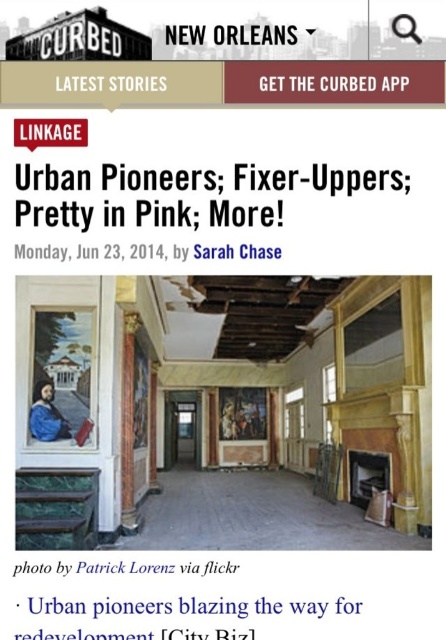
Question: Which point is farther to the camera?

Choices:
 (A) matte black text at upper center
 (B) white paper at center

Answer: (A)

Question: Considering the relative positions of white paper at center and matte black text at upper center in the image provided, where is white paper at center located with respect to matte black text at upper center?

Choices:
 (A) below
 (B) above

Answer: (A)

Question: Is white paper at center in front of matte black text at upper center?

Choices:
 (A) no
 (B) yes

Answer: (B)

Question: Which point is closer to the camera?

Choices:
 (A) white paper at center
 (B) matte black text at upper center

Answer: (A)

Question: Is the position of white paper at center less distant than that of matte black text at upper center?

Choices:
 (A) yes
 (B) no

Answer: (A)

Question: Which point is closer to the camera?

Choices:
 (A) (259, 257)
 (B) (223, 604)

Answer: (B)